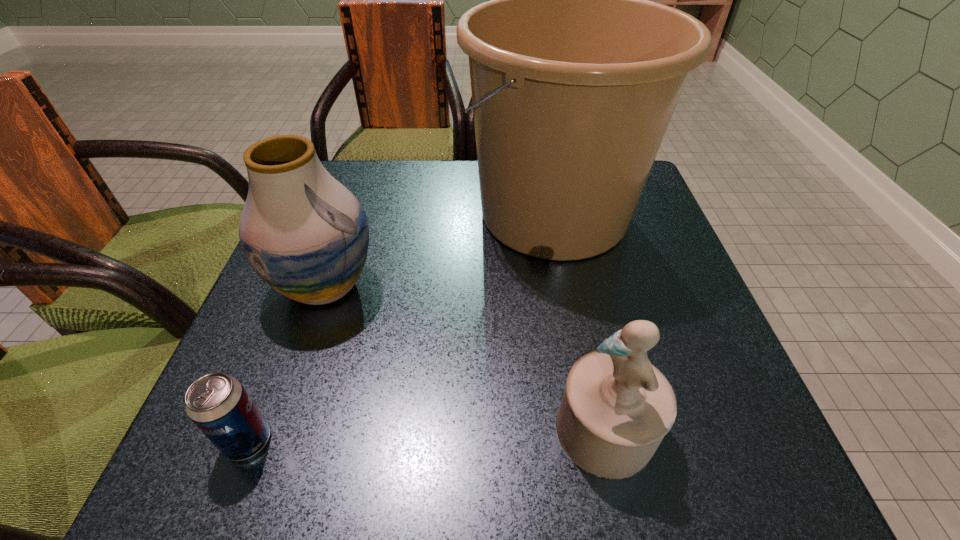
I want to click on the tallest object, so click(x=575, y=75).

Where is `vase`? This screenshot has height=540, width=960. vase is located at coordinates (305, 234).

You are a GUI agent. You are given a task and a screenshot of the screen. Output one action in this format:
    pyautogui.click(x=<x>, y=<y>)
    Task: Click on the figurine
    This screenshot has height=540, width=960.
    Given the screenshot: What is the action you would take?
    pyautogui.click(x=617, y=407)

Image resolution: width=960 pixels, height=540 pixels. I want to click on beer can, so click(218, 404).

I want to click on vacant region located 0.370m on the front of the bucket, so click(x=605, y=475).

This screenshot has width=960, height=540. I want to click on vacant position located 0.080m on the back of the vase, so click(346, 226).

Where is `vacant space located 0.110m at the beak of the figurine`? This screenshot has width=960, height=540. vacant space located 0.110m at the beak of the figurine is located at coordinates (480, 430).

Locate an element on the screen. The width and height of the screenshot is (960, 540). free location located 0.390m at the beak of the figurine is located at coordinates (286, 430).

The width and height of the screenshot is (960, 540). What are the coordinates of `vacant space located 0.160m at the beak of the figurine` in the screenshot? It's located at point(445,430).

The image size is (960, 540). In order to click on blank space located on the back of the shortest object in this screenshot , I will do `click(272, 377)`.